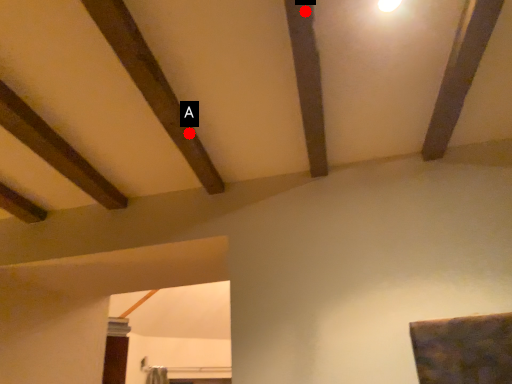
Question: Two points are circled on the image, labeled by A and B beside each circle. Which point is further to the camera?

Choices:
 (A) A is further
 (B) B is further

Answer: (A)